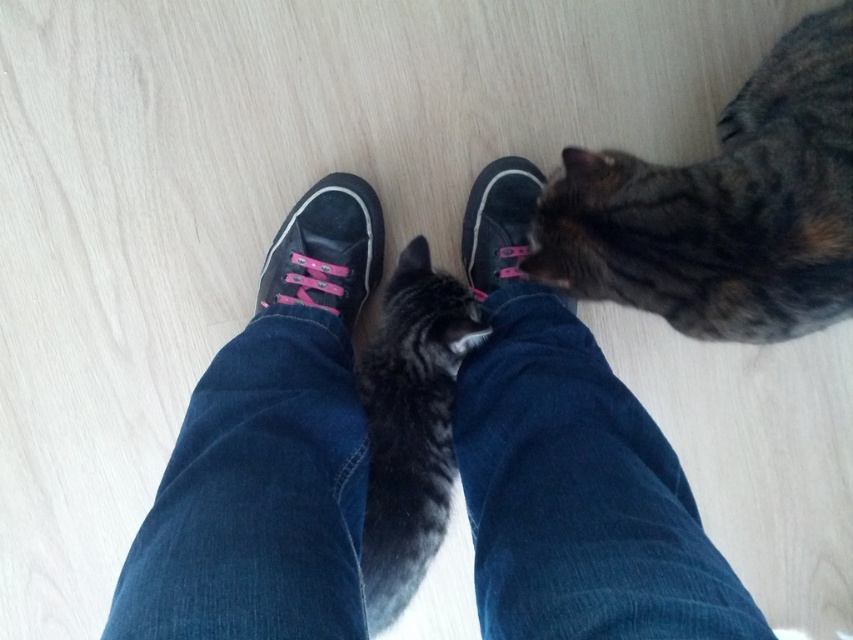
Between denim pants at center and gray striped fur at center, which one appears on the right side from the viewer's perspective?

From the viewer's perspective, denim pants at center appears more on the right side.

Between point (158, 627) and point (410, 508), which one is positioned behind?

The point (410, 508) is behind.

Which is in front, point (341, 572) or point (386, 572)?

Point (341, 572)

This screenshot has width=853, height=640. In order to click on denim pants at center in this screenshot , I will do `click(572, 468)`.

Does tabby fur cat at lower right lie in front of black canvas shoe at center?

Yes, tabby fur cat at lower right is closer to the viewer.

You are a GUI agent. You are given a task and a screenshot of the screen. Output one action in this format:
    pyautogui.click(x=<x>, y=<y>)
    Task: Click on the tabby fur cat at lower right
    
    Given the screenshot: What is the action you would take?
    pyautogui.click(x=724, y=208)

The height and width of the screenshot is (640, 853). Identify the location of tabby fur cat at lower right. (724, 208).

Does tabby fur cat at lower right appear under gray striped fur at center?

No, tabby fur cat at lower right is not below gray striped fur at center.

In the scene shown: Can you confirm if tabby fur cat at lower right is smaller than gray striped fur at center?

Incorrect, tabby fur cat at lower right is not smaller in size than gray striped fur at center.

Is point (817, 214) positioned after point (372, 557)?

No, (817, 214) is in front of (372, 557).

In order to click on tabby fur cat at lower right in this screenshot , I will do `click(724, 208)`.